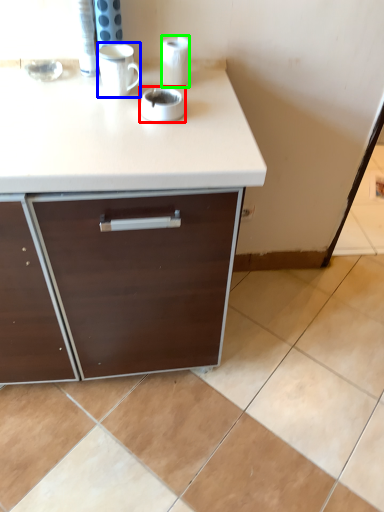
Question: Which object is the closest to the appliance (highlighted by a red box)? Choose among these: mug (highlighted by a blue box) or paper towel (highlighted by a green box).

Choices:
 (A) mug
 (B) paper towel

Answer: (A)